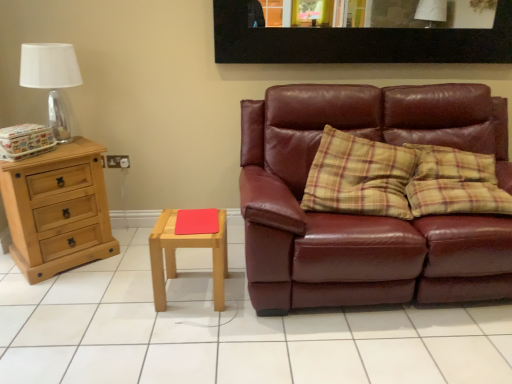
Identify the location of vacant area situated to the left side of light brown wooden stool at center. (128, 295).